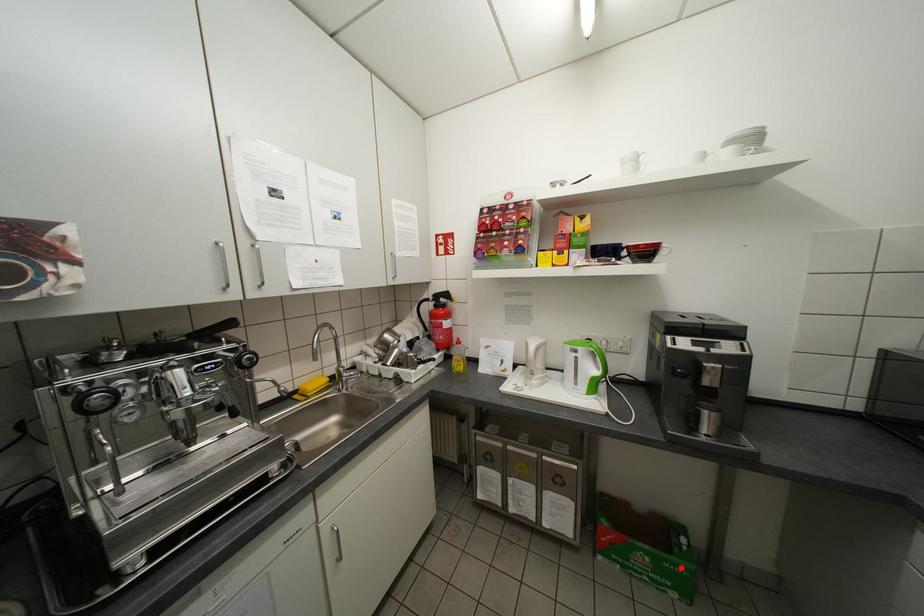
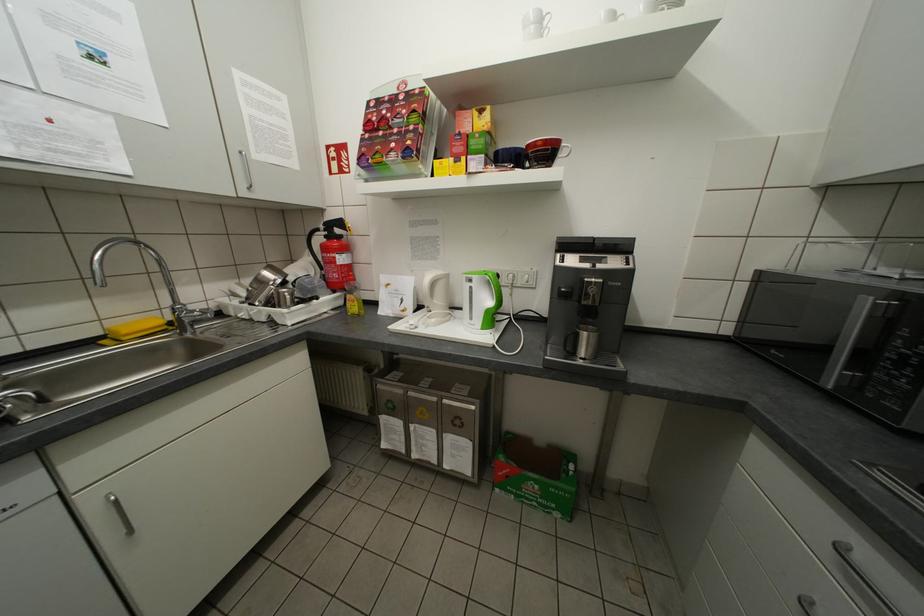
Question: I am providing you with two images of the same scene from different viewpoints. A red point is shown in image1. For the corresponding object point in image2, is it positioned nearer or farther from the camera?

Choices:
 (A) Nearer
 (B) Farther

Answer: (B)